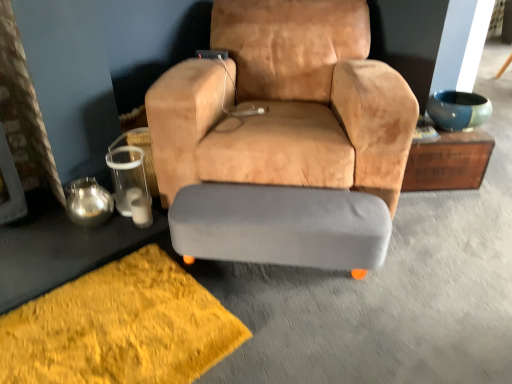
At what (x,y) coordinates should I click in order to perform the action: click on free space in front of wooden chest at upper right, which is the second table in left-to-right order. Please return your answer as a coordinate pair (x, y). Image resolution: width=512 pixels, height=384 pixels. Looking at the image, I should click on (445, 214).